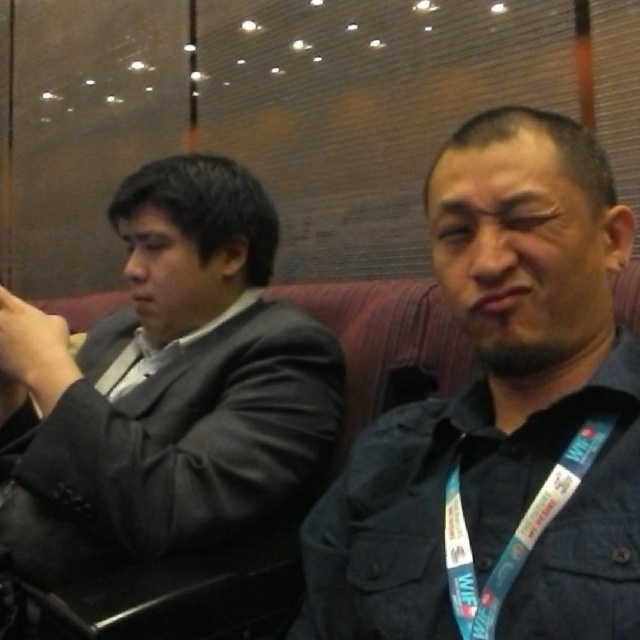
Question: Is dark blue denim jacket at center wider than blue fabric lanyard at right?

Choices:
 (A) no
 (B) yes

Answer: (B)

Question: Is dark blue denim jacket at center below blue fabric lanyard at right?

Choices:
 (A) no
 (B) yes

Answer: (A)

Question: In this image, where is matte black suit at left located relative to blue fabric lanyard at right?

Choices:
 (A) below
 (B) above

Answer: (B)

Question: Among these objects, which one is nearest to the camera?

Choices:
 (A) blue fabric lanyard at right
 (B) dark blue denim jacket at center
 (C) matte black suit at left

Answer: (B)

Question: Which object appears farthest from the camera in this image?

Choices:
 (A) dark blue denim jacket at center
 (B) matte black suit at left

Answer: (B)

Question: Among these points, which one is farthest from the camera?

Choices:
 (A) pos(412,616)
 (B) pos(241,186)

Answer: (B)